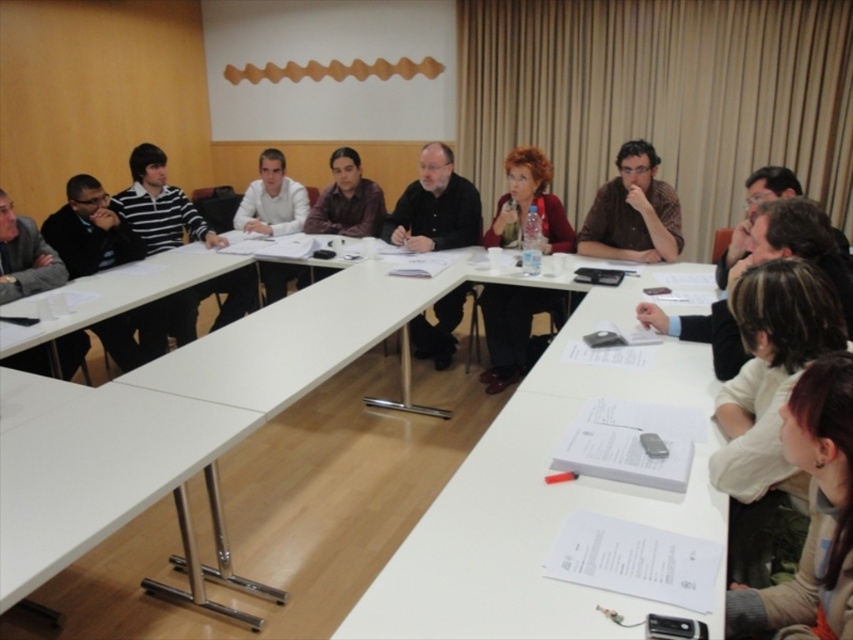
Question: Is white plastic table at lower right smaller than white glossy table at lower left?

Choices:
 (A) no
 (B) yes

Answer: (A)

Question: Estimate the real-world distances between objects in this image. Which object is farther from the brown matte shirt at center?

Choices:
 (A) white glossy table at lower left
 (B) matte red sweater at center

Answer: (A)

Question: Is matte black jacket at left further to camera compared to brown matte shirt at center?

Choices:
 (A) no
 (B) yes

Answer: (A)

Question: Which is nearer to the white fabric shirt at lower right?

Choices:
 (A) white plastic table at left
 (B) white glossy table at lower left
 (C) black matte shirt at center

Answer: (B)

Question: Can you confirm if brown textured shirt at center is positioned to the left of brown matte shirt at center?

Choices:
 (A) no
 (B) yes

Answer: (A)

Question: Among these points, which one is farthest from the camera?

Choices:
 (A) (374, 310)
 (B) (300, 228)
 (C) (10, 580)
 (D) (582, 372)

Answer: (B)